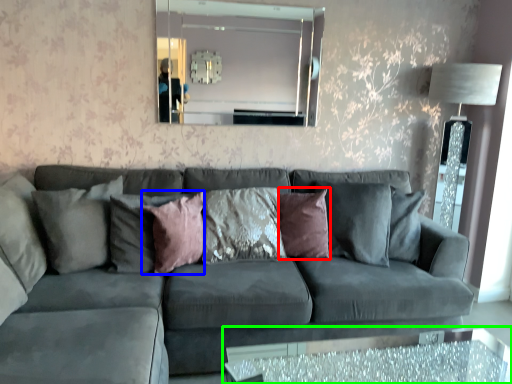
Question: Based on their relative distances, which object is farther from pillow (highlighted by a red box)? Choose from pillow (highlighted by a blue box) and table (highlighted by a green box).

Choices:
 (A) pillow
 (B) table

Answer: (B)